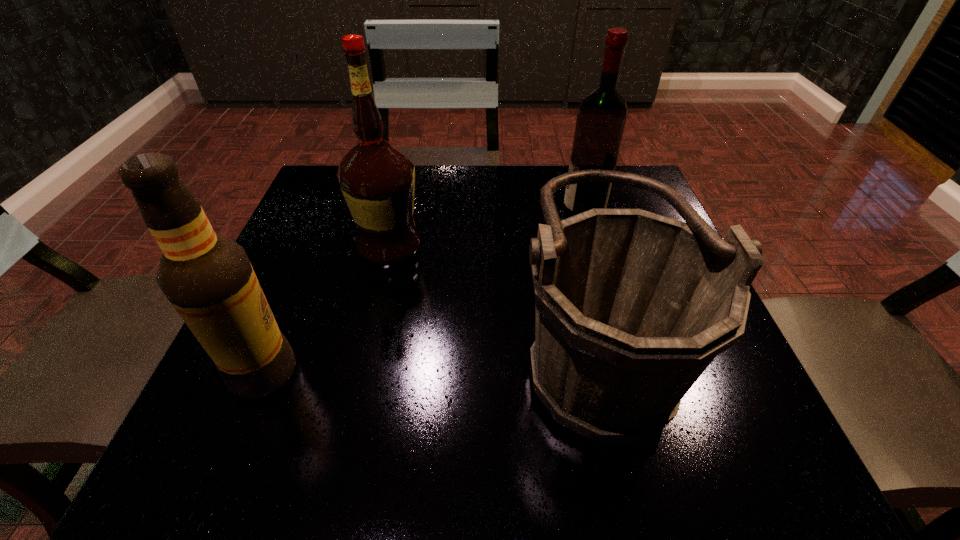
Where is `object that is at the near right corner`? object that is at the near right corner is located at coordinates (631, 307).

The image size is (960, 540). In the image, there is a desktop. What are the coordinates of `free space at the far edge` in the screenshot? It's located at (565, 188).

Where is `vacant area at the left edge`? vacant area at the left edge is located at coordinates (312, 283).

What are the coordinates of `vacant space at the far left corner of the desktop` in the screenshot? It's located at (326, 178).

The width and height of the screenshot is (960, 540). Identify the location of vacant area at the far right corner of the desktop. point(617,165).

Find the location of a particular element. Image resolution: width=960 pixels, height=540 pixels. free area in between the nearest alcohol and the second farthest object is located at coordinates tap(326, 310).

Where is `free area in between the rightmost alcohol and the third nearest object`? Image resolution: width=960 pixels, height=540 pixels. free area in between the rightmost alcohol and the third nearest object is located at coordinates (487, 231).

Find the location of a particular element. free point between the leftmost object and the farthest alcohol is located at coordinates (423, 293).

This screenshot has height=540, width=960. Find the location of `vacant region between the second farthest object and the shortest object`. vacant region between the second farthest object and the shortest object is located at coordinates (492, 300).

This screenshot has height=540, width=960. I want to click on unoccupied area between the bucket and the leftmost object, so click(428, 361).